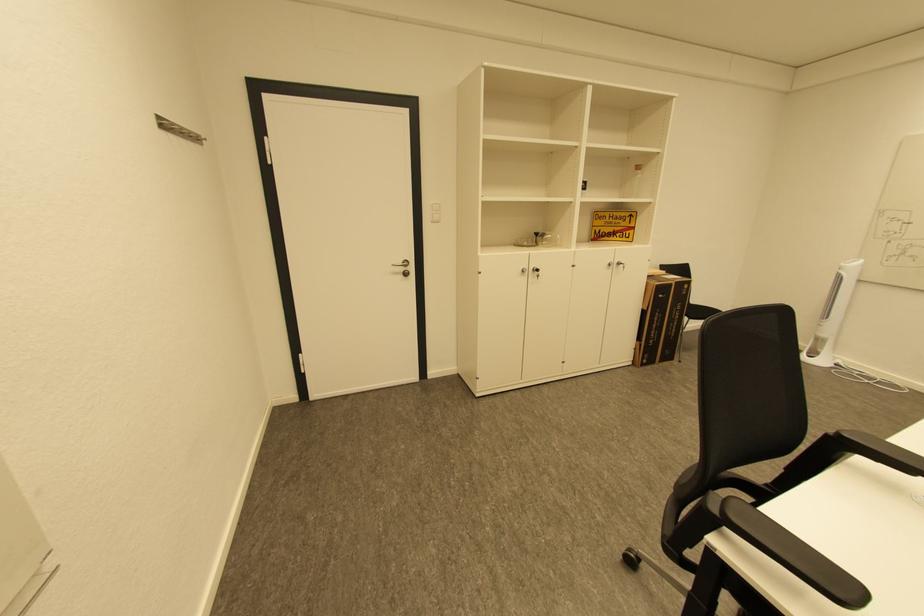
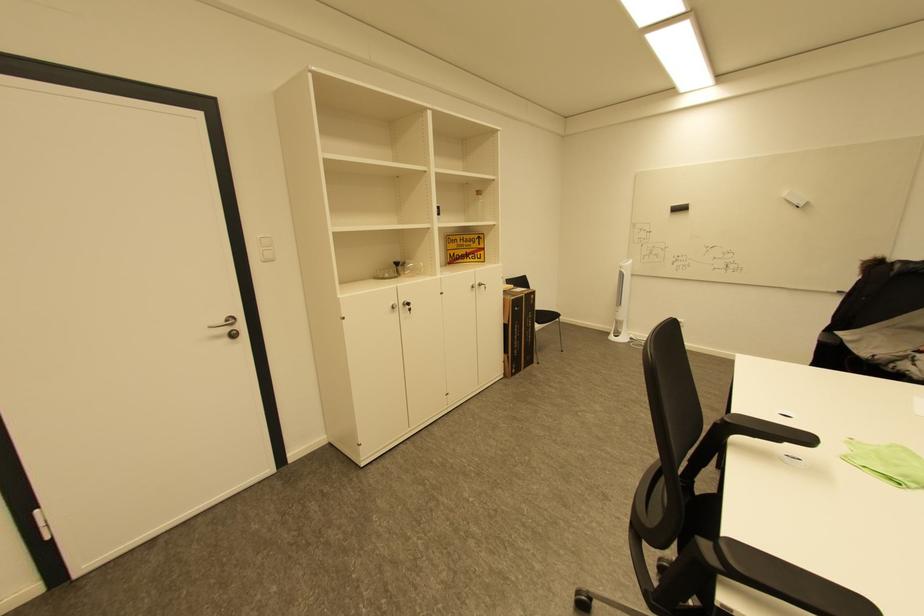
The point at (543, 235) is marked in the first image. Where is the corresponding point in the second image?

(403, 264)